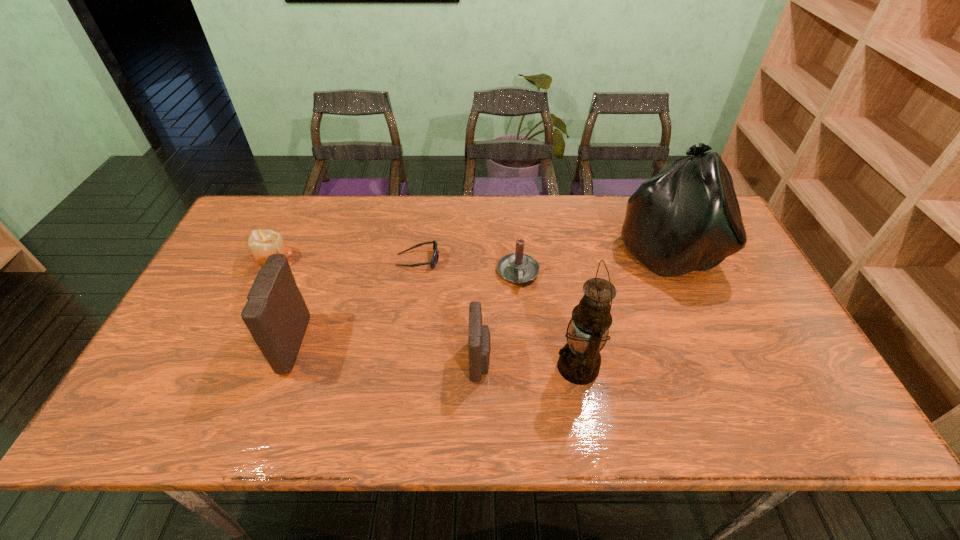
This screenshot has width=960, height=540. I want to click on unoccupied area between the plastic bag and the oil lamp, so click(x=622, y=309).

I want to click on vacant point located between the sixth object from left to right and the right candle, so click(x=548, y=320).

Where is `free space between the oil lamp and the plastic bag`? This screenshot has height=540, width=960. free space between the oil lamp and the plastic bag is located at coordinates (622, 309).

Locate an element on the screen. vacant region between the second object from right to left and the left candle is located at coordinates (425, 313).

Locate an element on the screen. empty space between the leftmost object and the plastic bag is located at coordinates (470, 255).

Where is `free space between the plastic bag and the fifth object from left to right`? The image size is (960, 540). free space between the plastic bag and the fifth object from left to right is located at coordinates (592, 262).

In order to click on free space between the taller pouch and the right candle in this screenshot , I will do `click(403, 309)`.

The image size is (960, 540). What are the coordinates of `vacant space in between the right candle and the rightmost object` in the screenshot? It's located at (592, 262).

The width and height of the screenshot is (960, 540). Find the location of `object that stands as the fifth closest to the fourth object from left to right`. object that stands as the fifth closest to the fourth object from left to right is located at coordinates (686, 218).

Point out which object is positioned as the sixth nearest to the sixth object from left to right. Please provide its 2D coordinates. Your answer should be formatted as a tuple, i.e. [(x, y)], where the tuple contains the x and y coordinates of a point satisfying the conditions above.

[(262, 242)]